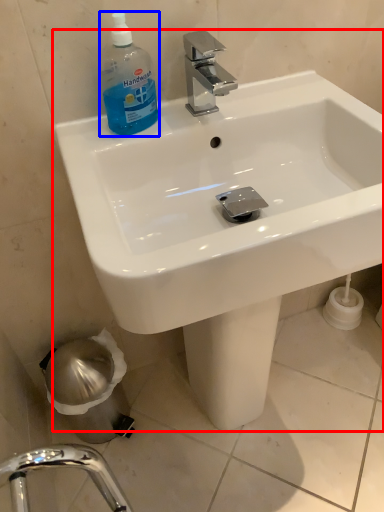
Question: Which of the following is the farthest to the observer, sink (highlighted by a red box) or cleaning product (highlighted by a blue box)?

Choices:
 (A) sink
 (B) cleaning product

Answer: (B)